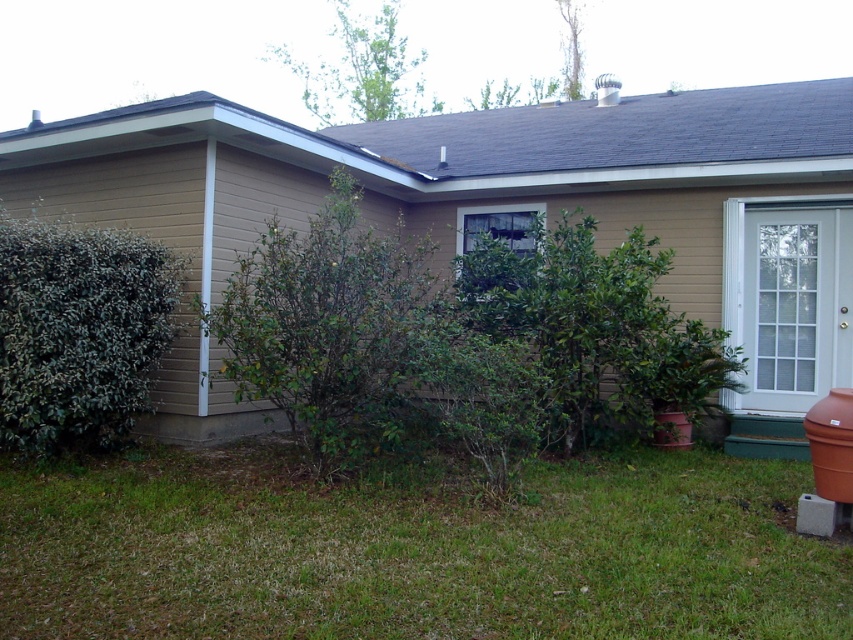
Question: Considering the real-world distances, which object is closest to the green leafy bush at left?

Choices:
 (A) green grass at lower center
 (B) green leafy bush at center

Answer: (B)

Question: Does green grass at lower center have a smaller size compared to green leafy bush at center?

Choices:
 (A) yes
 (B) no

Answer: (A)

Question: Can you confirm if green leafy bush at center is wider than green leafy bush at left?

Choices:
 (A) yes
 (B) no

Answer: (A)

Question: Which point is farther to the camera?

Choices:
 (A) green grass at lower center
 (B) green leafy bush at center

Answer: (B)

Question: Is green grass at lower center closer to the viewer compared to green leafy bush at left?

Choices:
 (A) no
 (B) yes

Answer: (B)

Question: Which object is closer to the camera taking this photo?

Choices:
 (A) green leafy bush at left
 (B) green leafy bush at center

Answer: (B)